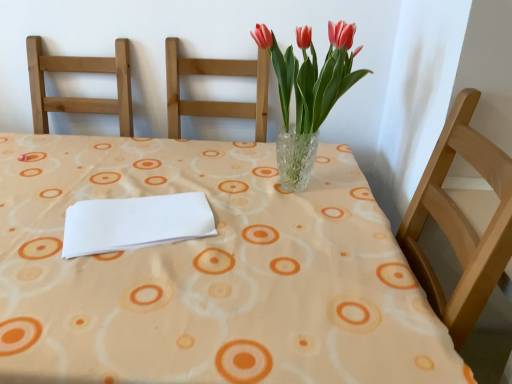
Question: Should I look upward or downward to see translucent glass vase at center?

Choices:
 (A) down
 (B) up

Answer: (B)

Question: Is white paper at center facing towards translucent glass vase at center?

Choices:
 (A) yes
 (B) no

Answer: (B)

Question: From the image's perspective, is white paper at center below translucent glass vase at center?

Choices:
 (A) no
 (B) yes

Answer: (B)

Question: Is white paper at center outside translucent glass vase at center?

Choices:
 (A) no
 (B) yes

Answer: (B)

Question: Does white paper at center have a greater height compared to translucent glass vase at center?

Choices:
 (A) yes
 (B) no

Answer: (B)

Question: Is white paper at center thinner than translucent glass vase at center?

Choices:
 (A) no
 (B) yes

Answer: (A)

Question: Does white paper at center lie in front of translucent glass vase at center?

Choices:
 (A) no
 (B) yes

Answer: (B)

Question: Is translucent glass vase at center closer to the viewer compared to clear glass vase at center?

Choices:
 (A) no
 (B) yes

Answer: (A)

Question: Can you confirm if translucent glass vase at center is wider than clear glass vase at center?

Choices:
 (A) no
 (B) yes

Answer: (A)

Question: Considering the relative positions of translucent glass vase at center and clear glass vase at center in the image provided, is translucent glass vase at center to the left of clear glass vase at center from the viewer's perspective?

Choices:
 (A) yes
 (B) no

Answer: (A)

Question: Does translucent glass vase at center have a larger size compared to clear glass vase at center?

Choices:
 (A) no
 (B) yes

Answer: (A)

Question: From the image's perspective, is translucent glass vase at center located beneath clear glass vase at center?

Choices:
 (A) yes
 (B) no

Answer: (B)

Question: From a real-world perspective, is translucent glass vase at center below clear glass vase at center?

Choices:
 (A) no
 (B) yes

Answer: (A)

Question: Considering the relative sizes of white paper at center and clear glass vase at center in the image provided, is white paper at center wider than clear glass vase at center?

Choices:
 (A) yes
 (B) no

Answer: (B)